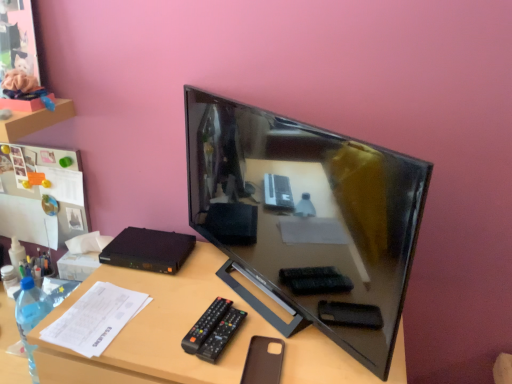
Question: Does brown leather phone case at lower center come in front of black plastic remote at lower center?

Choices:
 (A) no
 (B) yes

Answer: (B)

Question: From the image's perspective, is brown leather phone case at lower center located beneath black plastic remote at lower center?

Choices:
 (A) no
 (B) yes

Answer: (B)

Question: Considering the relative sizes of brown leather phone case at lower center and black plastic remote at lower center in the image provided, is brown leather phone case at lower center smaller than black plastic remote at lower center?

Choices:
 (A) no
 (B) yes

Answer: (B)

Question: From a real-world perspective, is brown leather phone case at lower center on top of black plastic remote at lower center?

Choices:
 (A) no
 (B) yes

Answer: (A)

Question: Could you tell me if brown leather phone case at lower center is facing black plastic remote at lower center?

Choices:
 (A) no
 (B) yes

Answer: (A)

Question: From the image's perspective, relative to black glossy television at center, is black plastic remote at lower center above or below?

Choices:
 (A) above
 (B) below

Answer: (B)

Question: In terms of size, does black plastic remote at lower center appear bigger or smaller than black glossy television at center?

Choices:
 (A) big
 (B) small

Answer: (B)

Question: In the image, is black plastic remote at lower center on the left side or the right side of black glossy television at center?

Choices:
 (A) right
 (B) left

Answer: (B)

Question: From a real-world perspective, is black plastic remote at lower center positioned above or below black glossy television at center?

Choices:
 (A) below
 (B) above

Answer: (A)

Question: Is brown leather phone case at lower center in front of or behind brown matte desk at center in the image?

Choices:
 (A) behind
 (B) front

Answer: (A)

Question: Is point (267, 342) closer or farther from the camera than point (144, 322)?

Choices:
 (A) farther
 (B) closer

Answer: (B)

Question: Considering the positions of brown leather phone case at lower center and brown matte desk at center in the image, is brown leather phone case at lower center taller or shorter than brown matte desk at center?

Choices:
 (A) tall
 (B) short

Answer: (B)

Question: From the image's perspective, is brown leather phone case at lower center located above or below brown matte desk at center?

Choices:
 (A) below
 (B) above

Answer: (B)

Question: Is white paper at lower left wider or thinner than brown leather phone case at lower center?

Choices:
 (A) thin
 (B) wide

Answer: (B)

Question: Based on their positions, is white paper at lower left located to the left or right of brown leather phone case at lower center?

Choices:
 (A) left
 (B) right

Answer: (A)